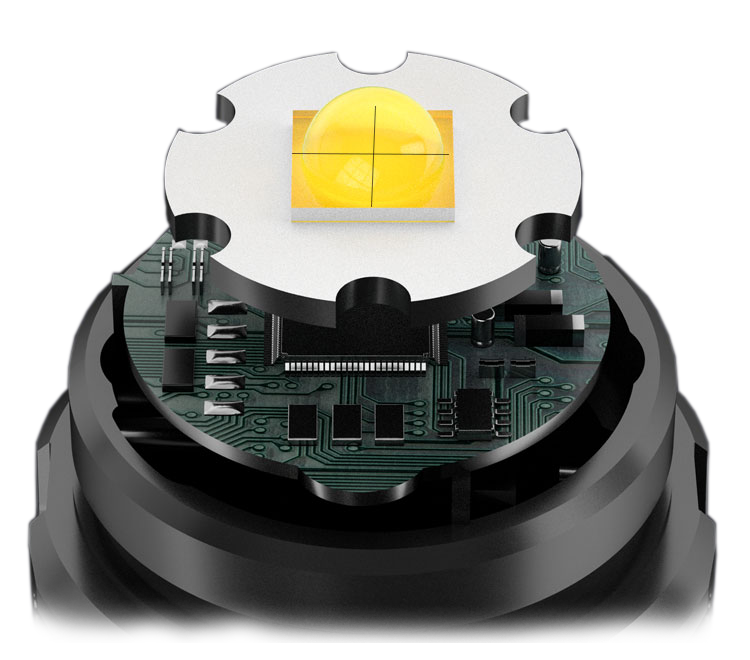
The height and width of the screenshot is (660, 750). Find the location of `board`. board is located at coordinates (535, 408).